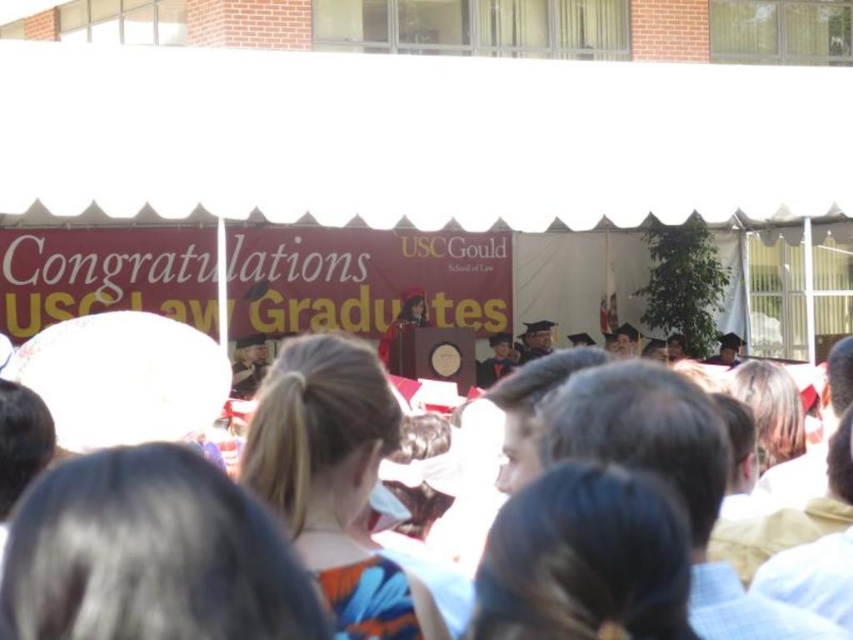
In the scene shown: Based on the scene description, what is located at the coordinates point (418, 138)?

The point (418, 138) marks the white fabric canopy at upper center.

Based on the scene description, what is the 2D coordinate of the white fabric canopy at upper center?

The white fabric canopy at upper center is located at the 2D coordinate point of (418, 138).

Looking at this image, you are a photographer at the graduation ceremony. You want to capture a photo where the white fabric canopy at upper center is clearly visible above the white cloth crowd at center. Is this possible based on their positions?

Yes, the white fabric canopy at upper center is above the white cloth crowd at center, so it can be clearly seen in the photo.